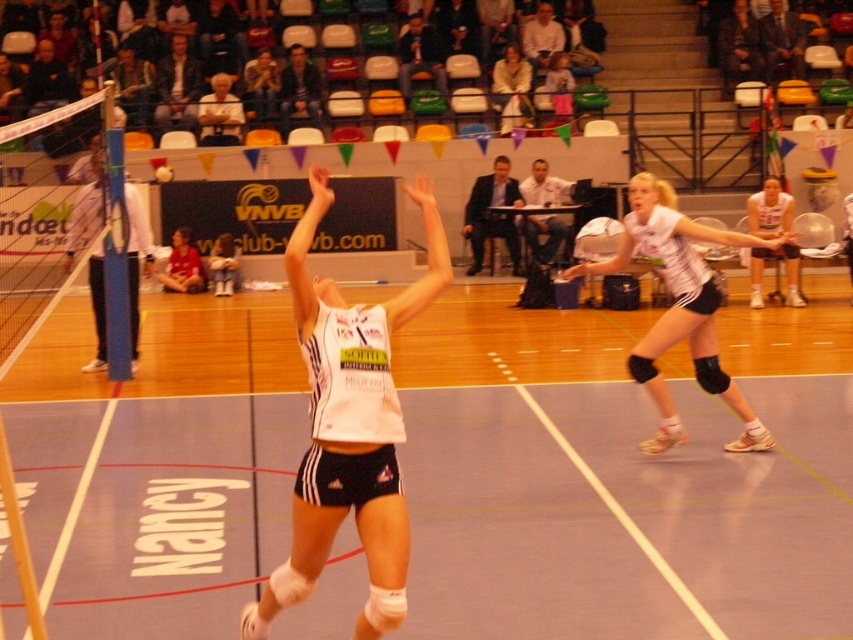
Question: Which of the following is the closest to the observer?

Choices:
 (A) (573, 269)
 (B) (416, 605)
 (C) (28, 236)

Answer: (B)

Question: Which is farther from the white matte uniform at center?

Choices:
 (A) white matte jersey at center
 (B) smooth wooden floor at center
 (C) white mesh net at left

Answer: (C)

Question: Is smooth wooden floor at center closer to camera compared to white mesh net at left?

Choices:
 (A) no
 (B) yes

Answer: (A)

Question: In this image, where is smooth wooden floor at center located relative to white matte jersey at center?

Choices:
 (A) below
 (B) above

Answer: (A)

Question: Which point is farther from the camera taking this photo?

Choices:
 (A) (94, 612)
 (B) (712, 291)

Answer: (B)

Question: Considering the relative positions of smooth wooden floor at center and white matte uniform at center in the image provided, where is smooth wooden floor at center located with respect to white matte uniform at center?

Choices:
 (A) right
 (B) left

Answer: (B)